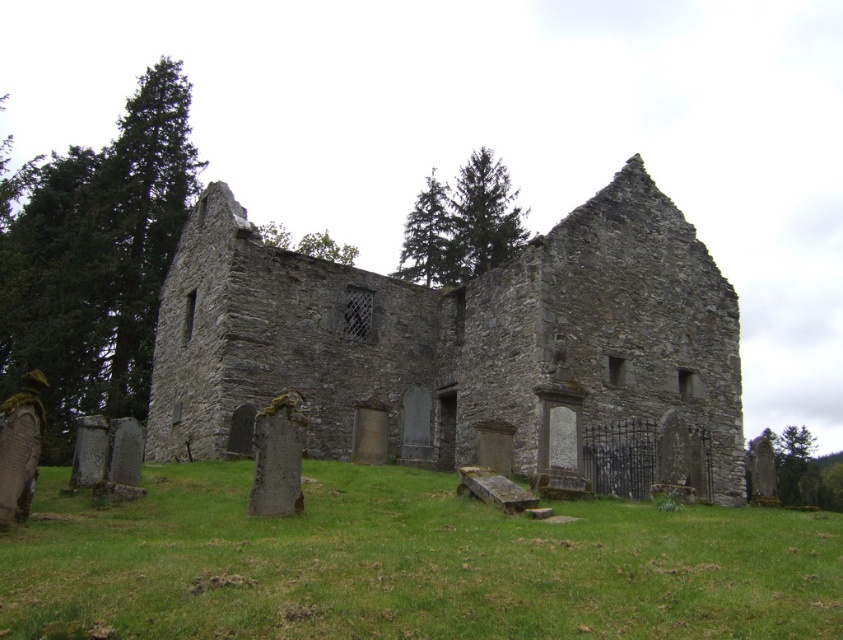
Question: Is green grass at center above gray stone castle at center?

Choices:
 (A) no
 (B) yes

Answer: (A)

Question: Observing the image, what is the correct spatial positioning of green grass at center in reference to gray stone castle at center?

Choices:
 (A) below
 (B) above

Answer: (A)

Question: Is green grass at center below gray stone castle at center?

Choices:
 (A) yes
 (B) no

Answer: (A)

Question: Which of the following is the closest to the observer?

Choices:
 (A) (152, 636)
 (B) (723, 500)

Answer: (A)